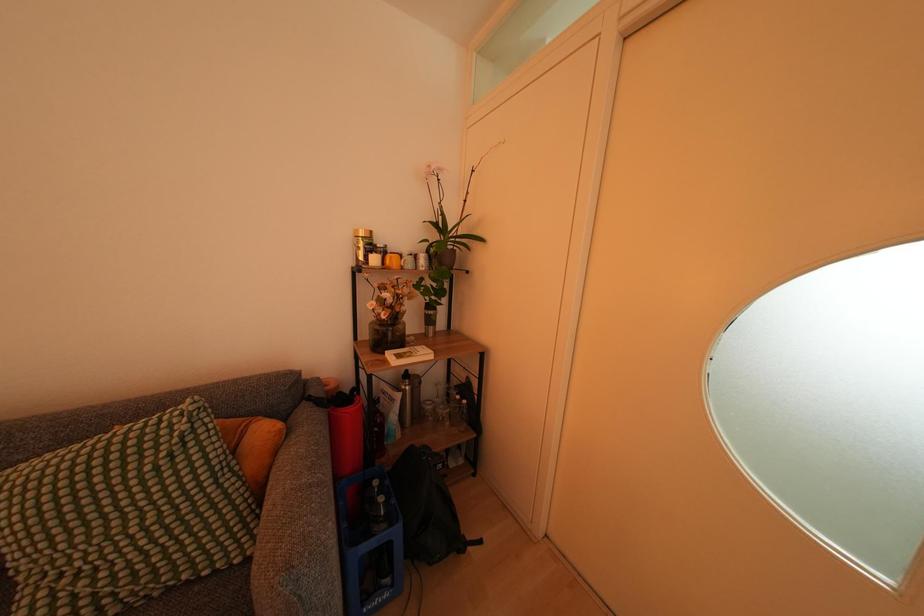
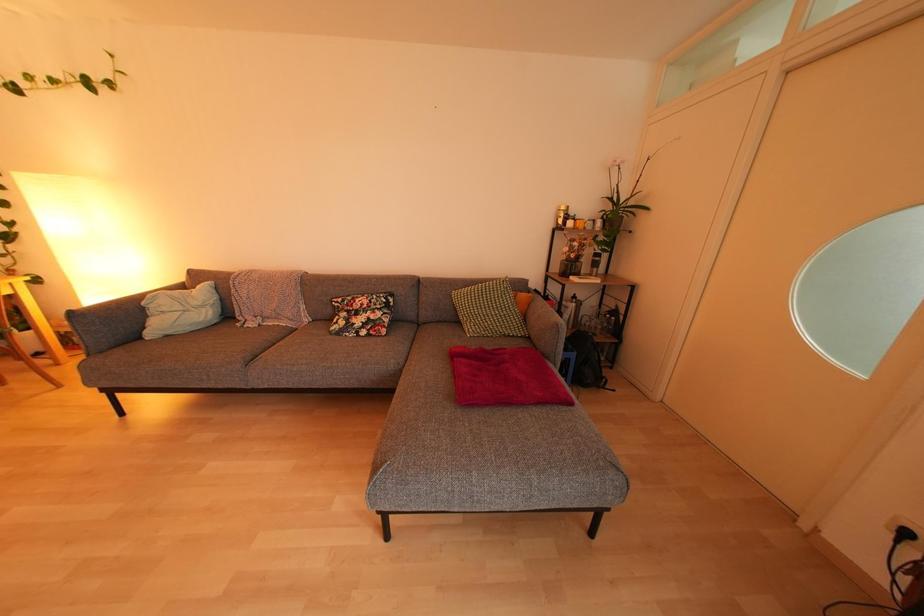
Question: The images are taken continuously from a first-person perspective. In which direction are you moving?

Choices:
 (A) Left
 (B) Right
 (C) Forward
 (D) Backward

Answer: (D)